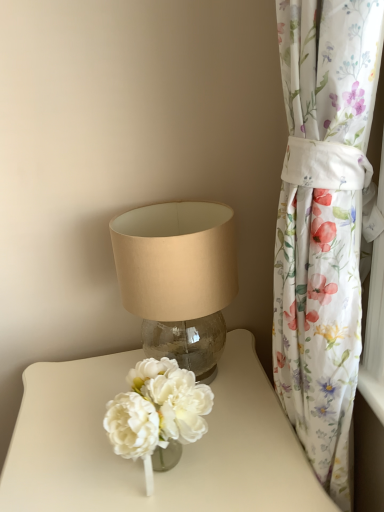
Find the location of a particular element. This screenshot has height=512, width=384. free space in front of beige fabric lampshade at center is located at coordinates 195,454.